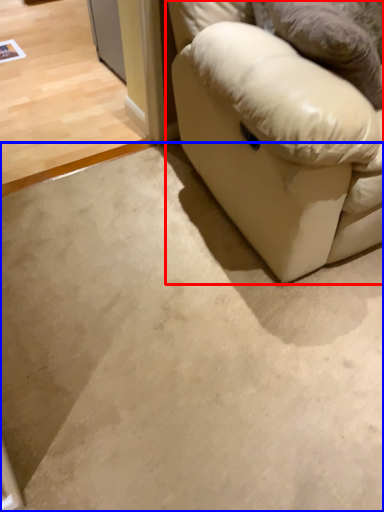
Question: Which of the following is the closest to the observer, studio couch (highlighted by a red box) or concrete (highlighted by a blue box)?

Choices:
 (A) studio couch
 (B) concrete

Answer: (A)